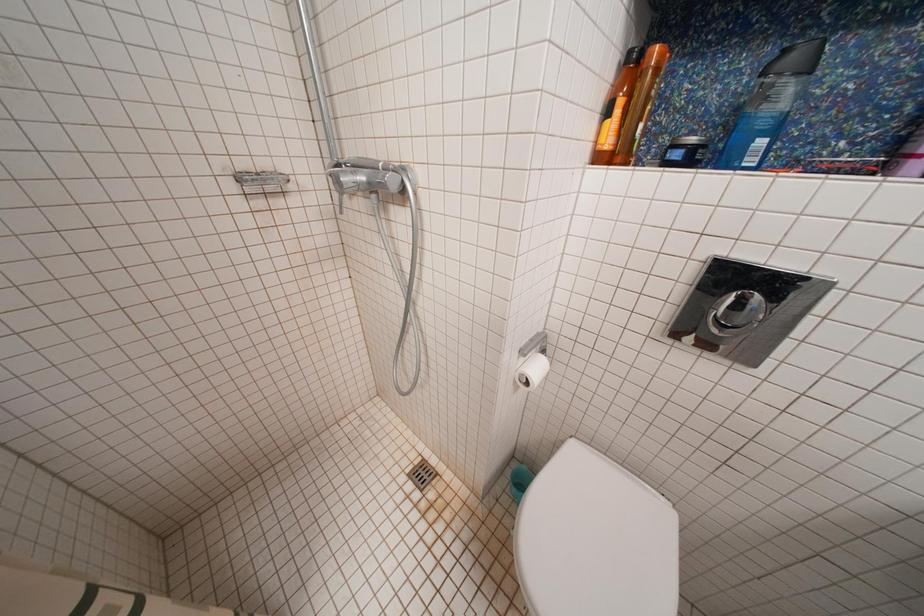
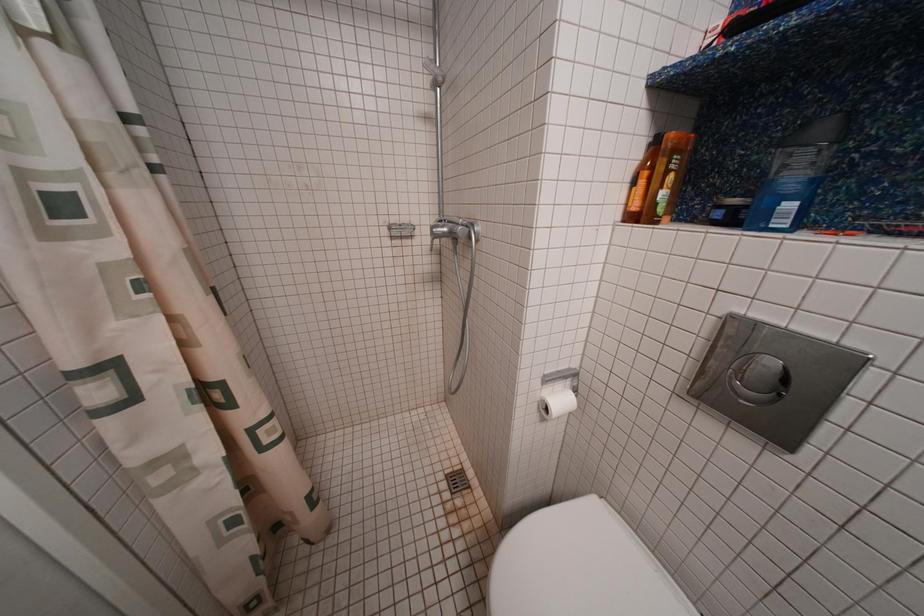
Question: The images are taken continuously from a first-person perspective. In which direction is your viewpoint rotating?

Choices:
 (A) Left
 (B) Right
 (C) Up
 (D) Down

Answer: (A)